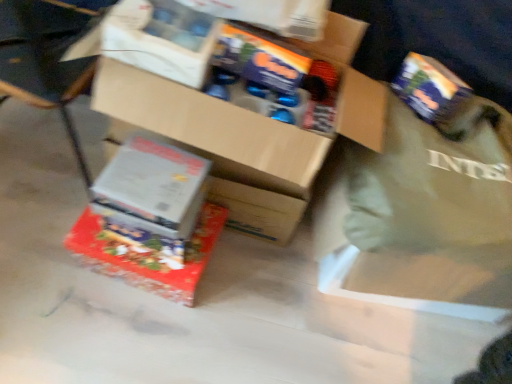
At what (x,y) coordinates should I click in order to perform the action: click on free spot in front of wooden chair at lower left. Please return your answer as a coordinate pair (x, y). Image resolution: width=512 pixels, height=384 pixels. Looking at the image, I should click on (50, 276).